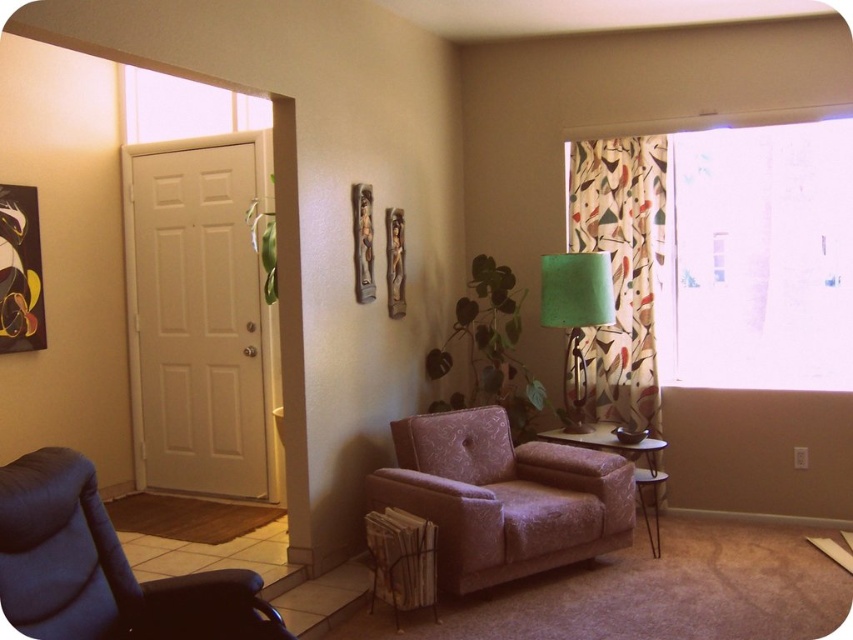
You are standing in the living room and want to sit down on either the pink textured couch at center or the velvet pink armchair at center. Which one do you need to walk towards to get closer to the front of the room?

The pink textured couch at center is closer to the viewer than the velvet pink armchair at center, so you should walk towards the pink textured couch at center to get closer to the front of the room.

You are planning to hang a new painting that is 1 meter tall. The painting must be placed above the pink textured couch at center. Is the transparent glass window at upper right in the way?

The transparent glass window at upper right is above the pink textured couch at center, so it would be in the way of hanging the painting there.